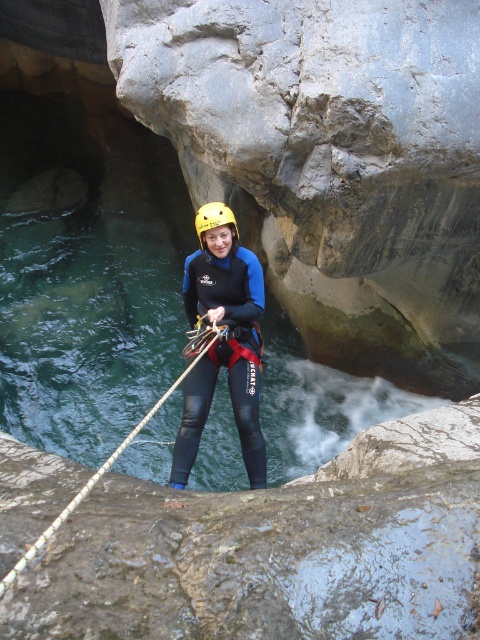
Question: Does roperoughrope at center have a larger size compared to yellow matte helmet at center?

Choices:
 (A) no
 (B) yes

Answer: (B)

Question: Does matte black wetsuit at center come behind yellow matte helmet at center?

Choices:
 (A) no
 (B) yes

Answer: (A)

Question: Which object appears closest to the camera in this image?

Choices:
 (A) matte black wetsuit at center
 (B) roperoughrope at center
 (C) yellow matte helmet at center

Answer: (B)

Question: Which object is the farthest from the yellow matte helmet at center?

Choices:
 (A) roperoughrope at center
 (B) matte black wetsuit at center

Answer: (A)

Question: Which object is the farthest from the matte black wetsuit at center?

Choices:
 (A) yellow matte helmet at center
 (B) roperoughrope at center

Answer: (A)

Question: Does matte black wetsuit at center have a lesser width compared to yellow matte helmet at center?

Choices:
 (A) yes
 (B) no

Answer: (B)